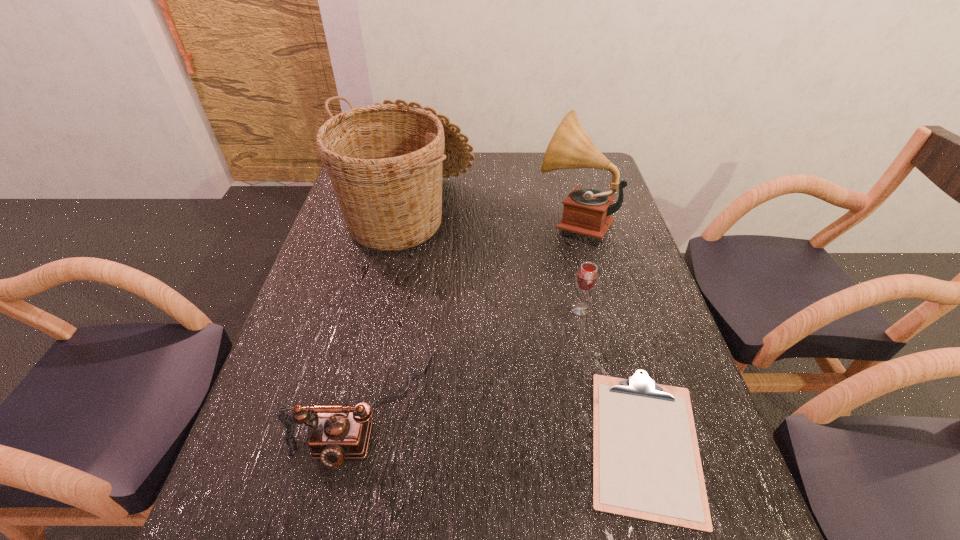
This screenshot has width=960, height=540. I want to click on free space located 0.050m on the dial of the telephone, so click(x=345, y=502).

At what (x,y) coordinates should I click in order to perform the action: click on free region located on the left of the shortest object. Please return your answer as a coordinate pair (x, y). Looking at the image, I should click on (383, 443).

Find the location of `object situated at the far edge`. object situated at the far edge is located at coordinates pyautogui.click(x=386, y=161).

I want to click on object positioned at the near edge, so click(x=646, y=463).

At what (x,y) coordinates should I click in order to perform the action: click on basket at the left edge. Please return your answer as a coordinate pair (x, y). Looking at the image, I should click on (386, 161).

The width and height of the screenshot is (960, 540). What are the coordinates of `telephone that is positioned at the left edge` in the screenshot? It's located at (339, 432).

Where is `phonograph record that is at the right edge`? phonograph record that is at the right edge is located at coordinates (587, 212).

This screenshot has height=540, width=960. In order to click on clipboard present at the right edge in this screenshot , I will do `click(646, 463)`.

Find the location of a particular element. object located at the far left corner is located at coordinates (386, 161).

This screenshot has width=960, height=540. Find the location of `object that is at the near right corner`. object that is at the near right corner is located at coordinates (646, 463).